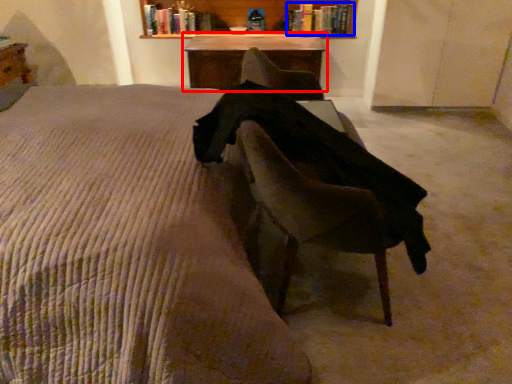
Question: Which object appears farthest to the camera in this image, table (highlighted by a red box) or book (highlighted by a blue box)?

Choices:
 (A) table
 (B) book

Answer: (B)